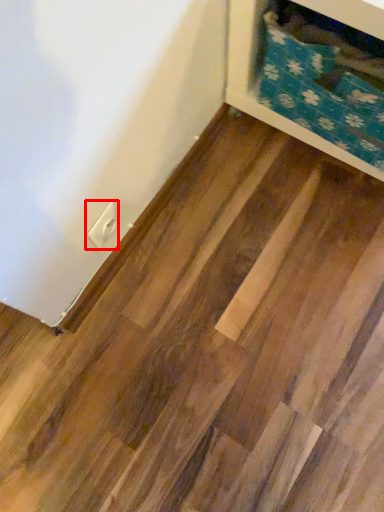
Question: In this image, where is electric outlet (annotated by the red box) located relative to furniture?

Choices:
 (A) right
 (B) left

Answer: (B)